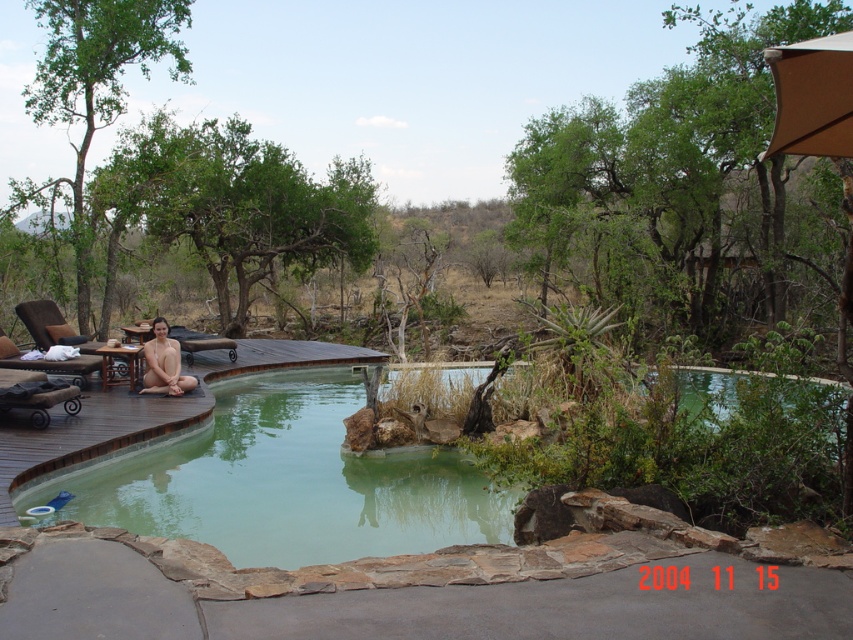
Does tan fabric umbrella at upper right lie in front of nude skin at lower left?

Yes, tan fabric umbrella at upper right is closer to the viewer.

Can you confirm if tan fabric umbrella at upper right is positioned to the left of nude skin at lower left?

In fact, tan fabric umbrella at upper right is to the right of nude skin at lower left.

Is point (833, 145) behind point (183, 390)?

No, it is in front of (183, 390).

Locate an element on the screen. Image resolution: width=853 pixels, height=640 pixels. tan fabric umbrella at upper right is located at coordinates (811, 97).

The width and height of the screenshot is (853, 640). What do you see at coordinates (289, 483) in the screenshot? I see `green stone pool at center` at bounding box center [289, 483].

In order to click on green stone pool at center in this screenshot , I will do `click(289, 483)`.

Does brown wooden deck at lower left have a lesser width compared to nude skin at lower left?

No, brown wooden deck at lower left is not thinner than nude skin at lower left.

Who is taller, brown wooden deck at lower left or nude skin at lower left?

brown wooden deck at lower left is taller.

Does point (79, 445) come closer to viewer compared to point (154, 339)?

Yes, it is in front of point (154, 339).

This screenshot has height=640, width=853. I want to click on brown wooden deck at lower left, so click(x=142, y=413).